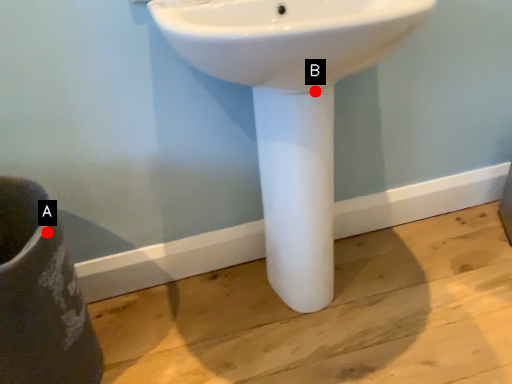
Question: Two points are circled on the image, labeled by A and B beside each circle. Which point is farther to the camera?

Choices:
 (A) A is further
 (B) B is further

Answer: (B)